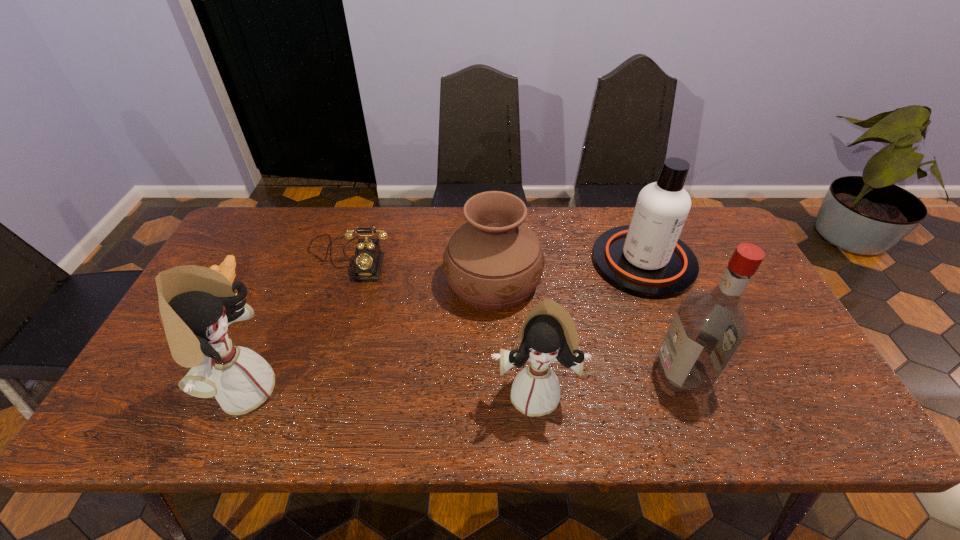
Find the location of a particular element. This screenshot has width=960, height=540. the taller doll is located at coordinates (197, 304).

Where is `the right doll`? This screenshot has height=540, width=960. the right doll is located at coordinates (548, 333).

This screenshot has width=960, height=540. Find the location of `cleansing agent`. cleansing agent is located at coordinates (646, 259).

Identify the location of the second shortest object. This screenshot has height=540, width=960. (368, 259).

At what (x,y) coordinates should I click in order to perform the action: click on urn. Please return your answer as a coordinate pair (x, y). Image resolution: width=960 pixels, height=540 pixels. Looking at the image, I should click on (493, 261).

This screenshot has height=540, width=960. I want to click on the shortest object, so click(227, 268).

The height and width of the screenshot is (540, 960). I want to click on the leftmost object, so click(x=227, y=268).

In order to click on liquor in this screenshot , I will do `click(708, 328)`.

Where is `free space located at the front face of the left doll`? The width and height of the screenshot is (960, 540). free space located at the front face of the left doll is located at coordinates (311, 390).

At what (x,y) coordinates should I click in order to perform the action: click on vacant area situated on the left of the cleansing agent. Please return your answer as a coordinate pair (x, y). Image resolution: width=960 pixels, height=540 pixels. Looking at the image, I should click on (496, 262).